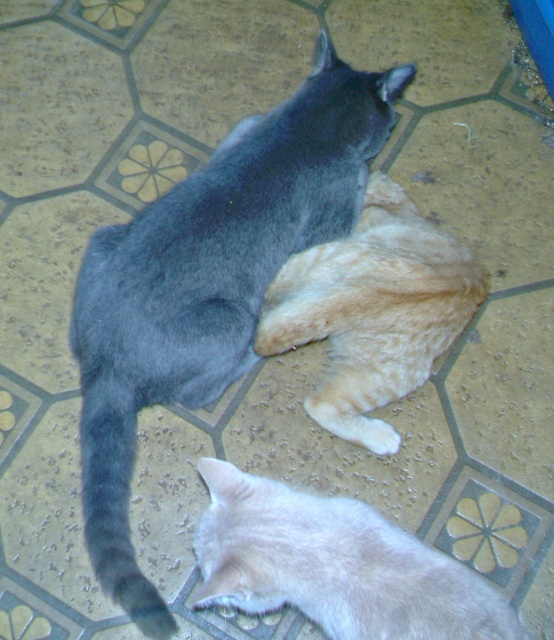
Question: Is gray matte cat at upper center bigger than tabby fur cat at lower center?

Choices:
 (A) no
 (B) yes

Answer: (B)

Question: Which point appears closest to the camera in this image?

Choices:
 (A) (240, 525)
 (B) (377, 300)

Answer: (A)

Question: Estimate the real-world distances between objects in this image. Which object is farther from the gray matte cat at upper center?

Choices:
 (A) tabby fur cat at lower center
 (B) orange tabby cat at center

Answer: (A)

Question: Considering the relative positions of gray matte cat at upper center and tabby fur cat at lower center in the image provided, where is gray matte cat at upper center located with respect to tabby fur cat at lower center?

Choices:
 (A) left
 (B) right

Answer: (A)

Question: Can you confirm if gray matte cat at upper center is positioned above tabby fur cat at lower center?

Choices:
 (A) no
 (B) yes

Answer: (B)

Question: Based on their relative distances, which object is nearer to the gray matte cat at upper center?

Choices:
 (A) orange tabby cat at center
 (B) tabby fur cat at lower center

Answer: (A)